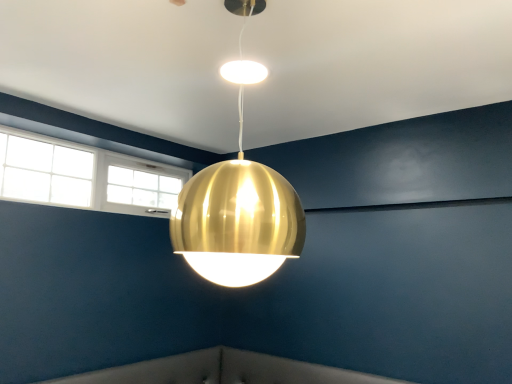
Question: Should I look upward or downward to see white glass window at upper left?

Choices:
 (A) up
 (B) down

Answer: (A)

Question: From the image's perspective, is gold metallic sphere at center on white glass window at upper left?

Choices:
 (A) yes
 (B) no

Answer: (A)

Question: Can you confirm if gold metallic sphere at center is shorter than white glass window at upper left?

Choices:
 (A) no
 (B) yes

Answer: (A)

Question: Considering the relative sizes of gold metallic sphere at center and white glass window at upper left in the image provided, is gold metallic sphere at center taller than white glass window at upper left?

Choices:
 (A) no
 (B) yes

Answer: (B)

Question: Is white glass window at upper left a part of gold metallic sphere at center?

Choices:
 (A) yes
 (B) no

Answer: (B)

Question: Is gold metallic sphere at center oriented towards white glass window at upper left?

Choices:
 (A) yes
 (B) no

Answer: (B)

Question: Is gold metallic sphere at center at the right side of white glass window at upper left?

Choices:
 (A) no
 (B) yes

Answer: (B)

Question: Can you confirm if white glass window at upper left is bigger than gold metallic sphere at center?

Choices:
 (A) yes
 (B) no

Answer: (B)

Question: Would you consider white glass window at upper left to be distant from gold metallic sphere at center?

Choices:
 (A) yes
 (B) no

Answer: (A)

Question: From a real-world perspective, is white glass window at upper left on top of gold metallic sphere at center?

Choices:
 (A) no
 (B) yes

Answer: (B)

Question: Is gold metallic sphere at center at the back of white glass window at upper left?

Choices:
 (A) no
 (B) yes

Answer: (A)

Question: Is white glass window at upper left smaller than gold metallic sphere at center?

Choices:
 (A) no
 (B) yes

Answer: (B)

Question: From the image's perspective, would you say white glass window at upper left is shown under gold metallic sphere at center?

Choices:
 (A) yes
 (B) no

Answer: (A)

Question: Is white glass window at upper left bigger or smaller than gold metallic sphere at center?

Choices:
 (A) big
 (B) small

Answer: (B)